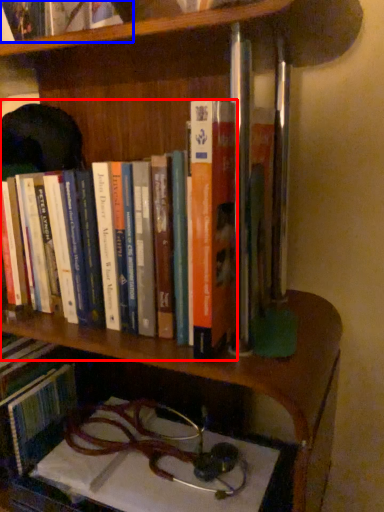
Question: Among these objects, which one is nearest to the camera, book (highlighted by a red box) or book (highlighted by a blue box)?

Choices:
 (A) book
 (B) book

Answer: (B)